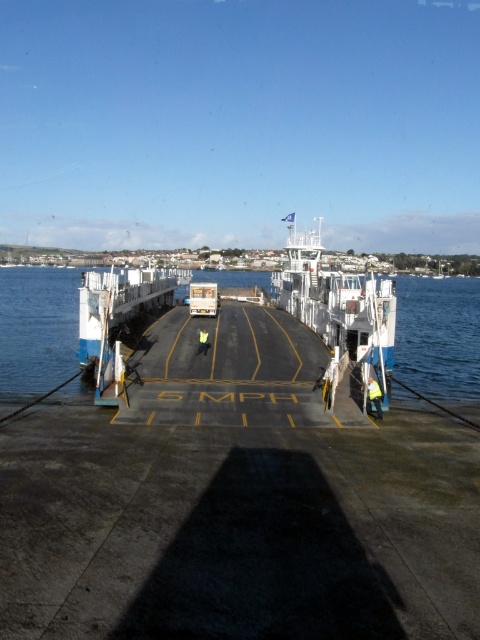
Question: Among these objects, which one is farthest from the camera?

Choices:
 (A) yellow reflective vest at center
 (B) blue water at center

Answer: (B)

Question: Does blue water at center appear over yellow reflective vest at center?

Choices:
 (A) no
 (B) yes

Answer: (B)

Question: Is white painted metal boat at center behind yellow reflective vest at lower right?

Choices:
 (A) yes
 (B) no

Answer: (A)

Question: Is white plastic container at center positioned in front of yellow reflective vest at lower right?

Choices:
 (A) yes
 (B) no

Answer: (B)

Question: Among these points, which one is farthest from the camera?

Choices:
 (A) coord(101,340)
 (B) coord(369,401)

Answer: (A)

Question: Which point appears farthest from the camera in this image?

Choices:
 (A) (59, 314)
 (B) (216, 289)
 (C) (197, 349)

Answer: (A)